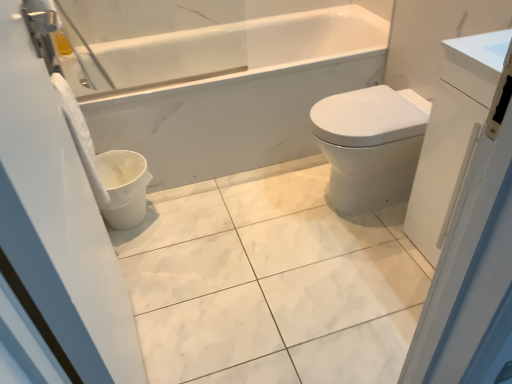
Where is `free space between white glossy cabinet at right, the 1th screen door positioned from the right, and white glossy toilet bowl at lower left`? The height and width of the screenshot is (384, 512). free space between white glossy cabinet at right, the 1th screen door positioned from the right, and white glossy toilet bowl at lower left is located at coordinates (274, 237).